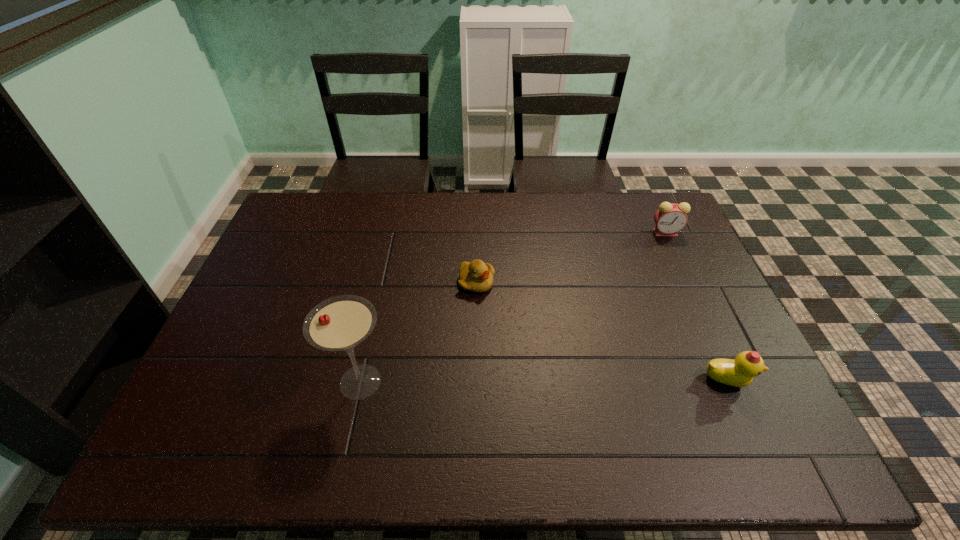
Locate an element on the screen. The image size is (960, 540). vacant space situated 0.350m at the beak of the left duckling is located at coordinates (575, 371).

You are a GUI agent. You are given a task and a screenshot of the screen. Output one action in this format:
    pyautogui.click(x=<x>, y=<y>)
    Task: Click on the vacant space situated on the face of the farthest object
    The width and height of the screenshot is (960, 540).
    Given the screenshot: What is the action you would take?
    pyautogui.click(x=629, y=264)

Identify the location of free space located 0.060m on the face of the farthest object. The width and height of the screenshot is (960, 540). (648, 244).

The width and height of the screenshot is (960, 540). Identify the location of free space located on the face of the farthest object. (629, 264).

Where is `object at the far edge`? object at the far edge is located at coordinates (670, 218).

Identify the location of martini positioned at the near edge. The height and width of the screenshot is (540, 960). (340, 323).

Where is `duckling that is positioned at the near edge`? duckling that is positioned at the near edge is located at coordinates (740, 372).

This screenshot has width=960, height=540. Identify the location of duckling at the right edge. tap(740, 372).

This screenshot has width=960, height=540. I want to click on alarm clock at the right edge, so coord(670,218).

Image resolution: width=960 pixels, height=540 pixels. What are the coordinates of `object that is at the far right corner` in the screenshot? It's located at (670, 218).